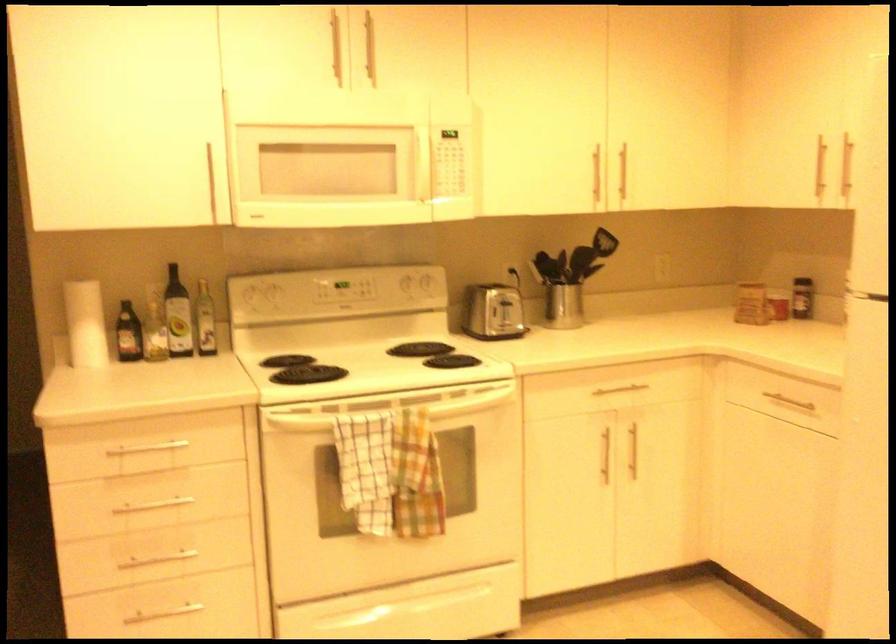
What are the coordinates of `paper towel roll` in the screenshot? It's located at (85, 324).